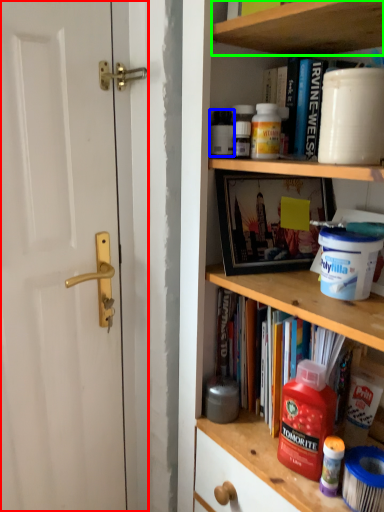
Question: Which object is positioned closest to door (highlighted by a red box)? Select from bottle (highlighted by a blue box) and cabinet (highlighted by a green box).

Choices:
 (A) bottle
 (B) cabinet

Answer: (A)